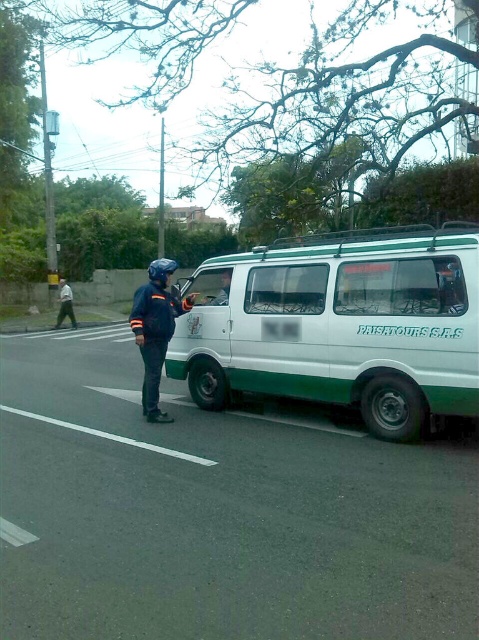
Measure the distance between white matte van at center and dark blue uniform at left.

15.06 meters

Who is shorter, white matte van at center or dark blue uniform at left?

With less height is dark blue uniform at left.

Is point (447, 346) in front of point (59, 308)?

Yes, it is in front of point (59, 308).

Locate an element on the screen. Image resolution: width=479 pixels, height=640 pixels. white matte van at center is located at coordinates (x=342, y=324).

Can you confirm if dark blue jacket at center is shorter than matte black helmet at upper center?

No.

Looking at this image, which is more to the left, dark blue jacket at center or matte black helmet at upper center?

From the viewer's perspective, dark blue jacket at center appears more on the left side.

Is point (148, 314) positioned after point (224, 292)?

No, (148, 314) is closer to viewer.

The width and height of the screenshot is (479, 640). I want to click on dark blue jacket at center, so [156, 330].

Is dark blue jacket at center bigger than dark blue uniform at left?

Correct, dark blue jacket at center is larger in size than dark blue uniform at left.

Can you confirm if dark blue jacket at center is positioned below dark blue uniform at left?

Yes, dark blue jacket at center is below dark blue uniform at left.

Is point (168, 260) positioned before point (64, 289)?

Yes, it is in front of point (64, 289).

Where is `dark blue jacket at center`? The image size is (479, 640). dark blue jacket at center is located at coordinates (156, 330).